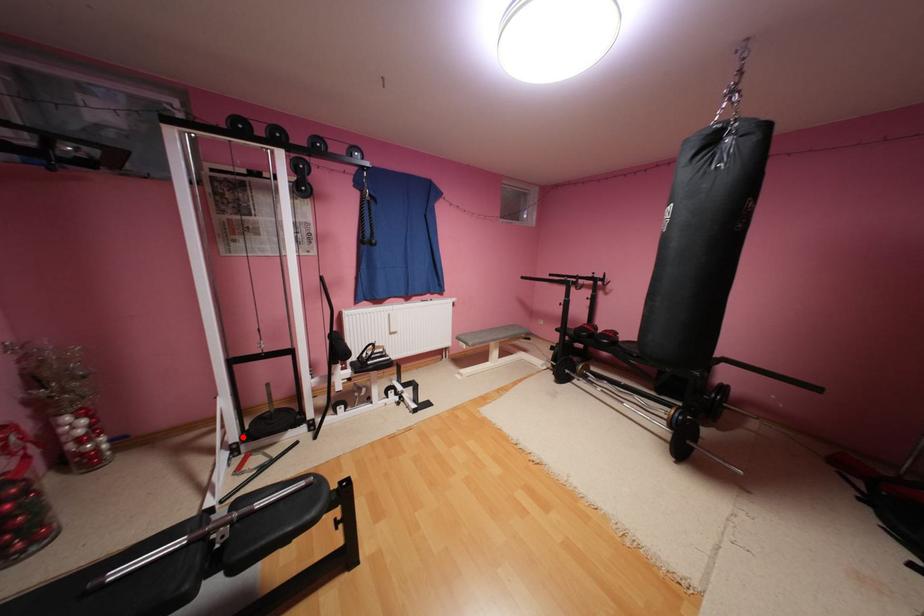
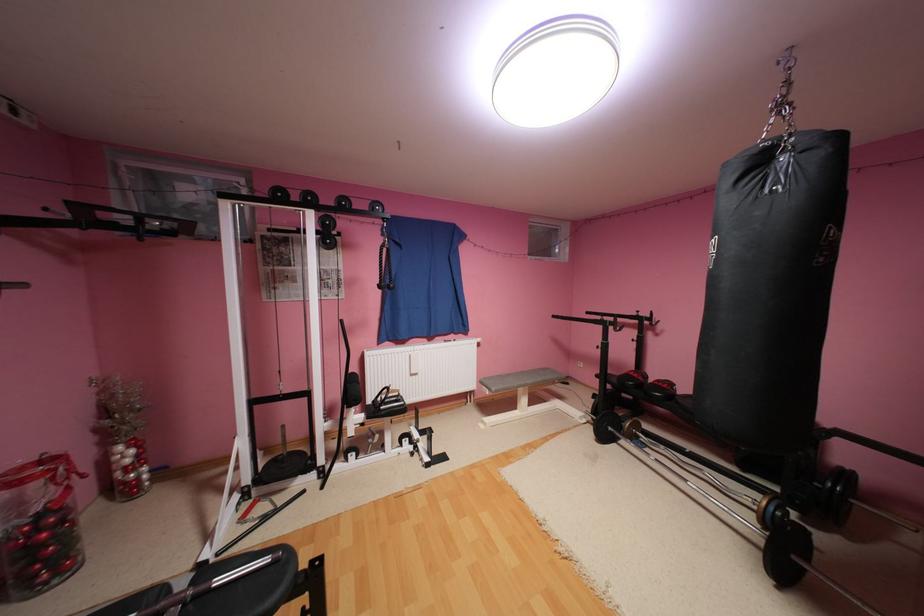
Locate, in the second image, the point that corresponds to the highlighted location in the first image.

(256, 479)